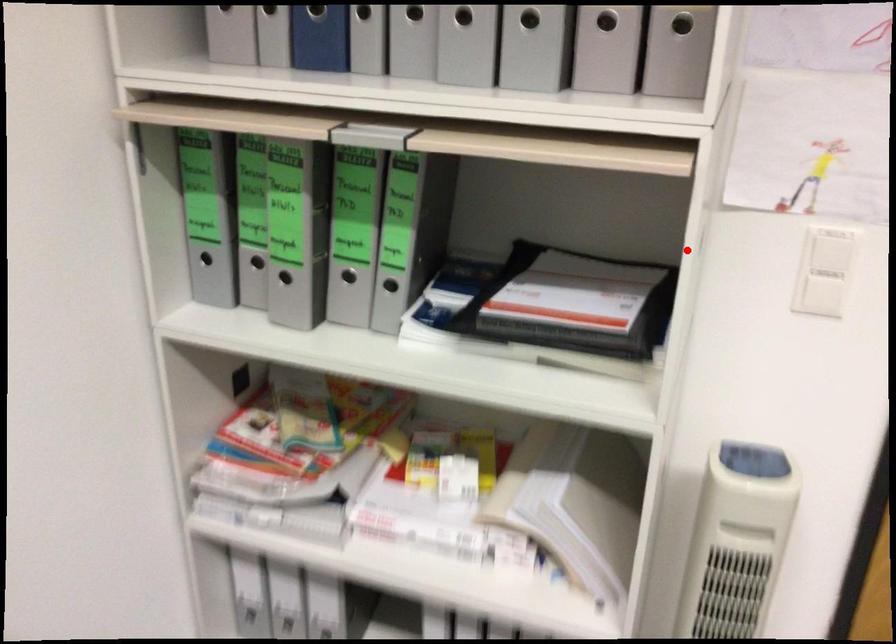
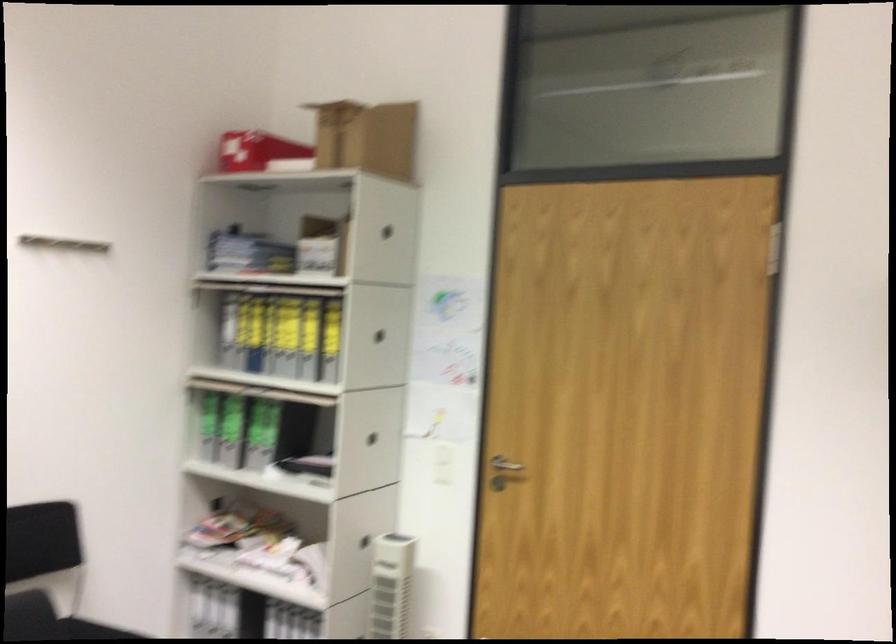
Question: I am providing you with two images of the same scene from different viewpoints. In image1, a red point is highlighted. Considering the same 3D point in image2, which of the following is correct?

Choices:
 (A) It is closer
 (B) It is farther

Answer: (B)